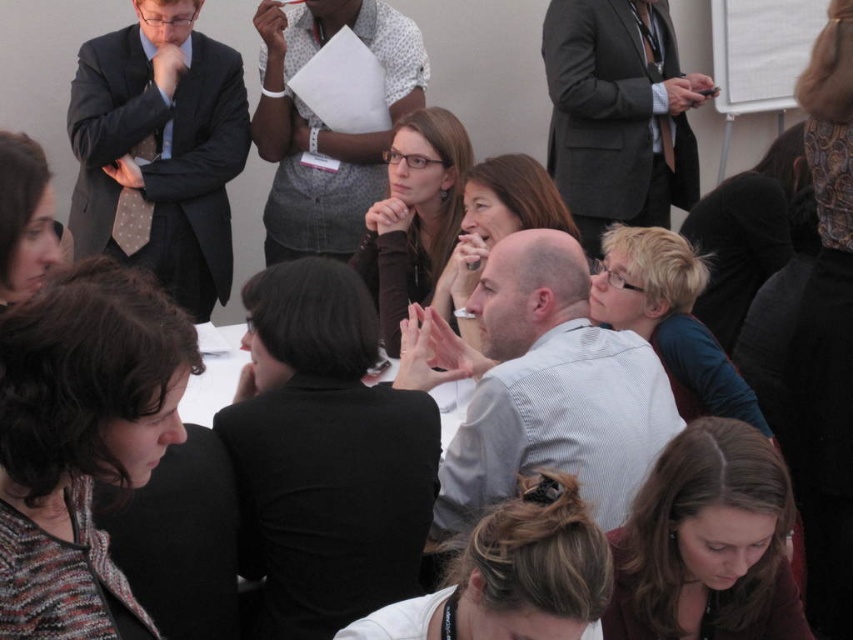
Measure the distance between point (613,288) and camera.

8.67 feet

Who is more distant from viewer, (682, 346) or (6, 154)?

Positioned behind is point (682, 346).

Image resolution: width=853 pixels, height=640 pixels. Find the location of `blonde hair at center`. blonde hair at center is located at coordinates (669, 317).

Locate an element on the screen. Image resolution: width=853 pixels, height=640 pixels. blonde hair at center is located at coordinates (669, 317).

Which of these two, multicolored knitted sweater at lower left or blonde hair bun at center, stands taller?

multicolored knitted sweater at lower left

Who is shorter, multicolored knitted sweater at lower left or blonde hair bun at center?

With less height is blonde hair bun at center.

Who is more distant from viewer, (10,467) or (596,552)?

The point (596,552) is behind.

Locate an element on the screen. This screenshot has height=640, width=853. multicolored knitted sweater at lower left is located at coordinates (80, 442).

Does smooth brown hair at lower center come in front of matte black hair at lower left?

No, smooth brown hair at lower center is behind matte black hair at lower left.

Where is `smooth brown hair at lower center`? The width and height of the screenshot is (853, 640). smooth brown hair at lower center is located at coordinates (706, 541).

The width and height of the screenshot is (853, 640). What do you see at coordinates (706, 541) in the screenshot? I see `smooth brown hair at lower center` at bounding box center [706, 541].

Where is `smooth brown hair at lower center`? The image size is (853, 640). smooth brown hair at lower center is located at coordinates (706, 541).